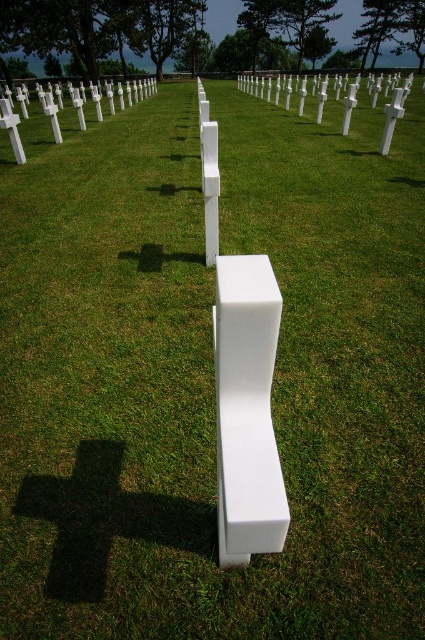
You are standing in the cemetery looking at the rows of white crosses. There is a point marked at coordinates (286, 92). What object is located at this point?

The point at coordinates (286, 92) marks the location of the white matte cross at center.

You are a photographer planning to capture a symmetrical composition of the white matte cross at center and the white matte cross at upper left. Considering their sizes, which cross should you focus on to maintain symmetry in your photo?

To maintain symmetry, focus on the white matte cross at center since it has a larger width than the white matte cross at upper left, allowing both to balance visually in the composition.

You are standing at the point marked by the unique cross with a curved horizontal beam in the cemetery. If you walk straight ahead towards the direction you are facing, will you eventually reach the point labeled as point [291,88]?

The point labeled as point [291,88] is 31.43 meters away from the viewer. Since you are facing the direction of the point, walking straight ahead will lead you to it.